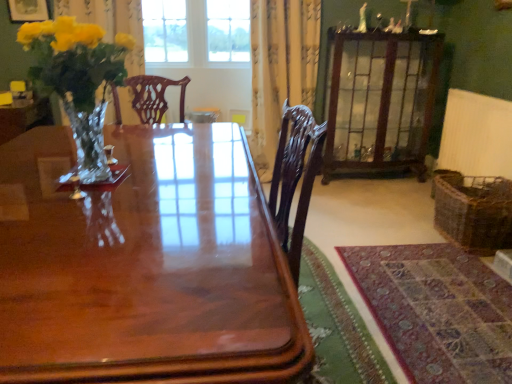
Where is `free space in front of wooden glass cabinet at upper right`? This screenshot has width=512, height=384. free space in front of wooden glass cabinet at upper right is located at coordinates (372, 200).